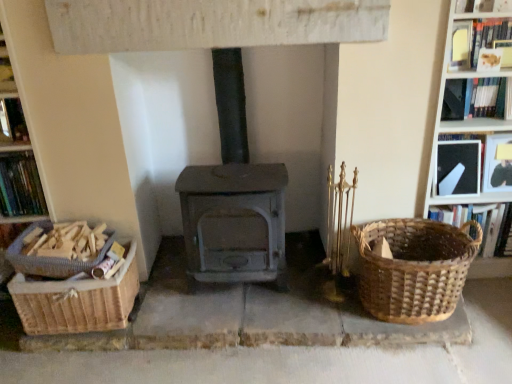
Find the location of `free space that is to the left of brown woven basket at right, the second basket viewed from the left`. free space that is to the left of brown woven basket at right, the second basket viewed from the left is located at coordinates (307, 296).